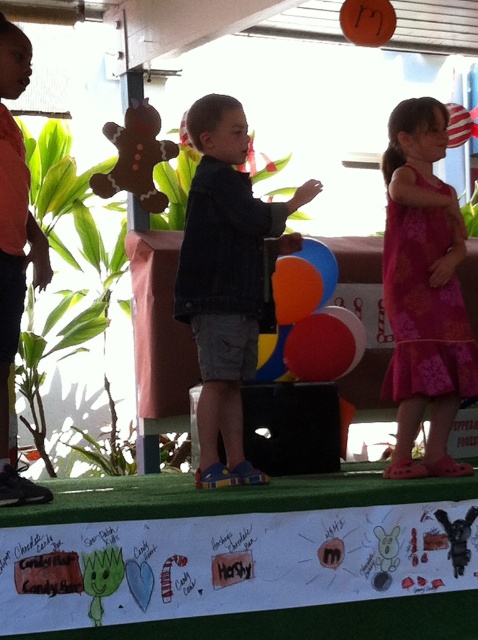
You are a stagehand who needs to place a microphone stand between the denim jacket at center and the felt gingerbread man at upper left. The microphone stand requires at least 1.5 meters of space between the two objects to be placed safely. Can you place it there?

The denim jacket at center is 1.72 meters away from the felt gingerbread man at upper left. Since the required space is 1.5 meters, the microphone stand can be placed safely between them as the distance is sufficient.